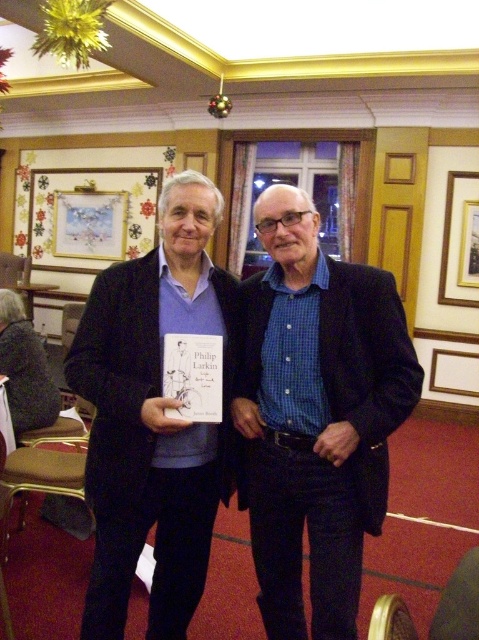
You are organizing a bookshelf and need to place the matte black book at center and the gold metallic picture frame at upper right. Given their sizes, which item should you place first to ensure both fit properly?

The matte black book at center has a larger width than the gold metallic picture frame at upper right. Therefore, you should place the matte black book at center first to ensure there is enough space for both items on the shelf.